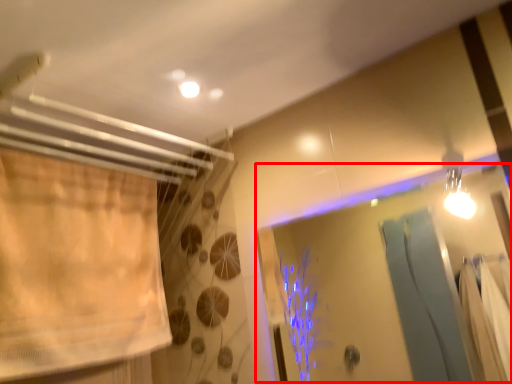
Question: From the image's perspective, what is the correct spatial relationship of screen door (annotated by the red box) in relation to curtain?

Choices:
 (A) above
 (B) below

Answer: (B)